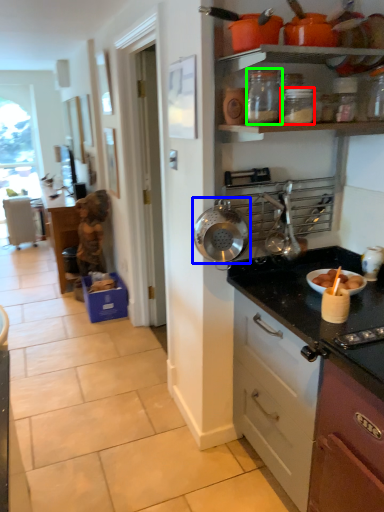
Question: Which object is positioned farthest from kitchen appliance (highlighted by a red box)? Select from kitchen appliance (highlighted by a blue box) and kitchen appliance (highlighted by a green box).

Choices:
 (A) kitchen appliance
 (B) kitchen appliance

Answer: (A)